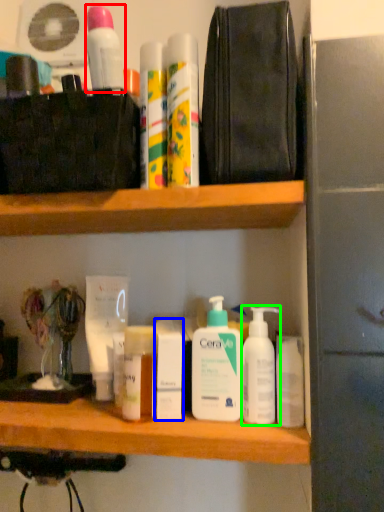
Question: Based on their relative distances, which object is nearer to mouthwash (highlighted by a red box)? Choose from toiletry (highlighted by a blue box) and cleaning product (highlighted by a green box).

Choices:
 (A) toiletry
 (B) cleaning product

Answer: (A)